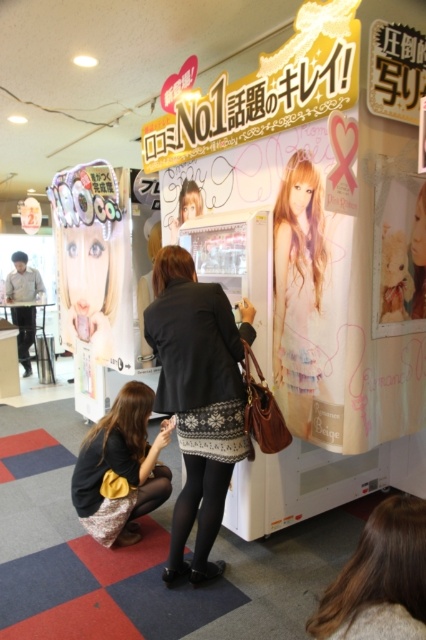
Is black textured sweater at center shorter than blonde hair at lower center?

In fact, black textured sweater at center may be taller than blonde hair at lower center.

Describe the element at coordinates (198, 397) in the screenshot. I see `black textured sweater at center` at that location.

Is point (193, 321) in front of point (408, 612)?

No, (193, 321) is further to viewer.

Locate an element on the screen. The height and width of the screenshot is (640, 426). black textured sweater at center is located at coordinates (198, 397).

In the scene shown: Which of these two, black textured sweater at center or matte black skirt at lower left, stands taller?

black textured sweater at center

How far apart are black textured sweater at center and matte black skirt at lower left?

16.96 inches

Which is behind, point (226, 404) or point (160, 445)?

Point (160, 445)

Identify the location of black textured sweater at center. (198, 397).

Can you confirm if blonde hair at lower center is positioned to the right of matte black skirt at lower left?

Correct, you'll find blonde hair at lower center to the right of matte black skirt at lower left.

Is blonde hair at lower center above matte black skirt at lower left?

Yes.

Is point (409, 624) less distant than point (132, 394)?

That is True.

The width and height of the screenshot is (426, 640). Find the location of `blonde hair at lower center`. blonde hair at lower center is located at coordinates (379, 579).